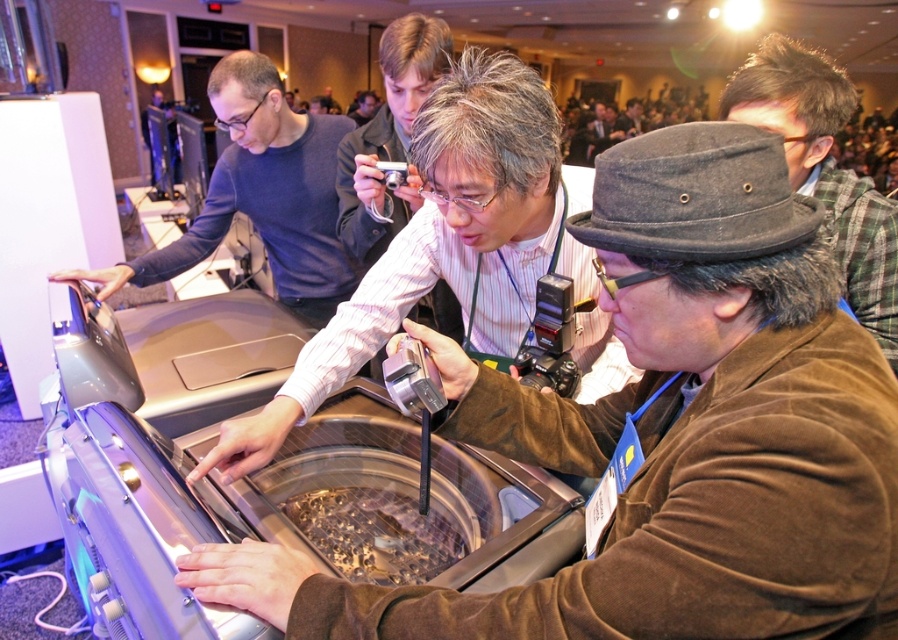
The height and width of the screenshot is (640, 898). Describe the element at coordinates (447, 243) in the screenshot. I see `matte black shirt at center` at that location.

Does matte black shirt at center appear on the right side of dark gray fur hat at upper right?

No, matte black shirt at center is not to the right of dark gray fur hat at upper right.

Find the location of a particular element. matte black shirt at center is located at coordinates (447, 243).

Who is higher up, matte black shirt at center or matte black shirt at left?

matte black shirt at left

Is matte black shirt at center closer to the viewer compared to matte black shirt at left?

That is True.

At what (x,y) coordinates should I click in order to perform the action: click on matte black shirt at center. Please return your answer as a coordinate pair (x, y). This screenshot has height=640, width=898. Looking at the image, I should click on [x=447, y=243].

Consider the image. Does matte black shirt at left have a lesser width compared to dark gray fur hat at upper right?

No, matte black shirt at left is not thinner than dark gray fur hat at upper right.

Does matte black shirt at left have a lesser height compared to dark gray fur hat at upper right?

Indeed, matte black shirt at left has a lesser height compared to dark gray fur hat at upper right.

Where is `matte black shirt at left`? The image size is (898, 640). matte black shirt at left is located at coordinates (261, 195).